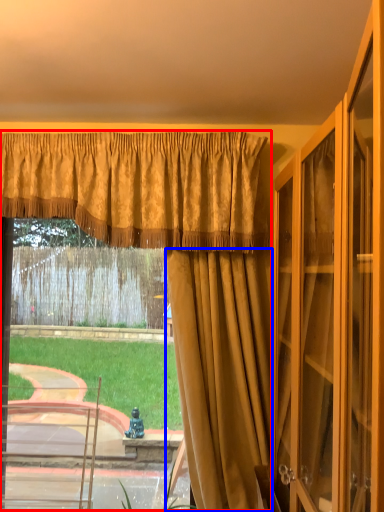
Question: Which point is further to the camera, curtain (highlighted by a red box) or curtain (highlighted by a blue box)?

Choices:
 (A) curtain
 (B) curtain

Answer: (A)